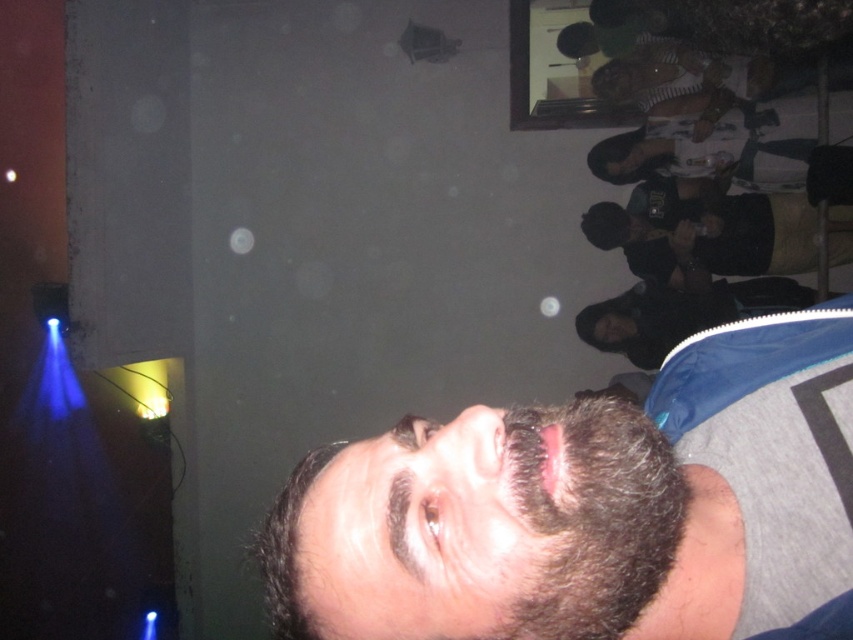
Question: Is dark brown fuzzy beard at lower center smaller than black matte jacket at right?

Choices:
 (A) no
 (B) yes

Answer: (B)

Question: Is dark brown fuzzy beard at lower center below dark blue shirt at right?

Choices:
 (A) no
 (B) yes

Answer: (B)

Question: Considering the real-world distances, which object is closest to the dark blue shirt at right?

Choices:
 (A) smooth skin face at upper right
 (B) black matte jacket at right
 (C) dark brown fuzzy beard at lower center
 (D) dark brown hair at center

Answer: (B)

Question: Which point is closer to the camera taking this photo?

Choices:
 (A) (753, 611)
 (B) (671, 316)

Answer: (A)

Question: Which point appears closest to the camera in this image?

Choices:
 (A) (759, 227)
 (B) (579, 554)
 (C) (598, 340)

Answer: (B)

Question: Where is dark blue shirt at right located in relation to black matte jacket at right in the image?

Choices:
 (A) above
 (B) below

Answer: (A)